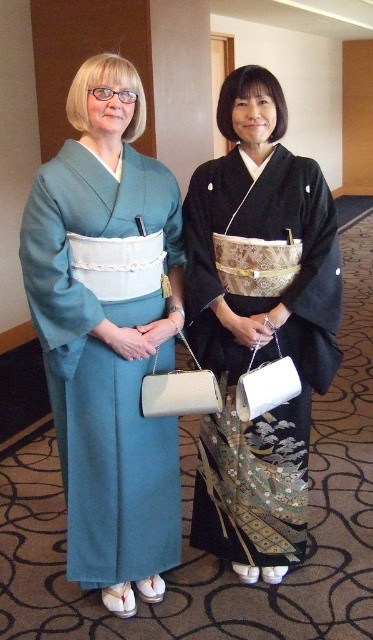
You are a photographer setting up for a photoshoot. You need to position two models wearing the teal silk kimono at left and black silk kimono at center so that there is at least 15 inches of space between them for a wide shot. Based on the current arrangement, is the distance sufficient?

The teal silk kimono at left is 12.35 inches away from black silk kimono at center. Since 12.35 inches is less than the required 15 inches, the current distance is insufficient for the wide shot. The models need to move further apart.

You are planning to wear a kimono for a formal event and have both the teal silk kimono at left and the black silk kimono at center available. Which kimono would you choose if you want the one that is wider?

The black silk kimono at center has a greater width than the teal silk kimono at left, so you should choose the black silk kimono at center for a wider option.

You are standing in a room with two people wearing kimonos. There is a point at coordinates (x=108, y=333). Which kimono is this point located on?

The point at coordinates (x=108, y=333) is located on the teal silk kimono at left.